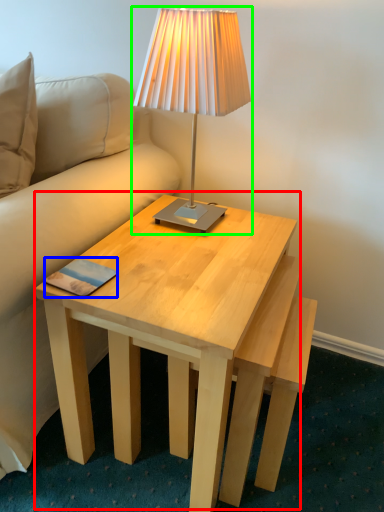
Question: Based on their relative distances, which object is nearer to coffee table (highlighted by a red box)? Choose from pad (highlighted by a blue box) and lamp (highlighted by a green box).

Choices:
 (A) pad
 (B) lamp

Answer: (A)